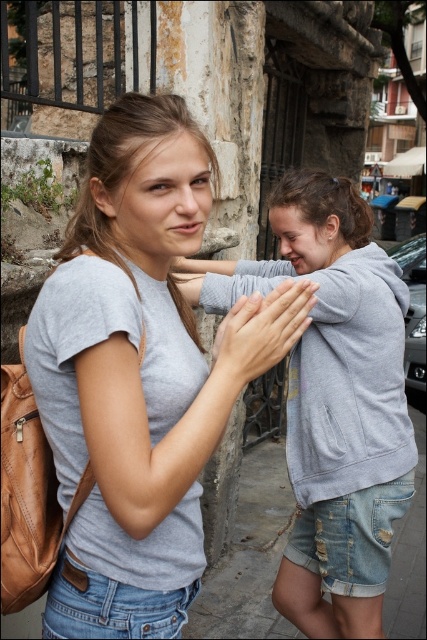
Question: Can you confirm if gray matte t-shirt at center is positioned below matte gray hand at center?

Choices:
 (A) no
 (B) yes

Answer: (B)

Question: Which point appears farthest from the camera in this image?

Choices:
 (A) (157, 445)
 (B) (251, 323)
 (C) (310, 529)

Answer: (C)

Question: Does gray matte t-shirt at center appear on the left side of matte gray hoodie at center?

Choices:
 (A) no
 (B) yes

Answer: (B)

Question: Among these objects, which one is farthest from the camera?

Choices:
 (A) matte gray hand at center
 (B) matte gray hoodie at center

Answer: (B)

Question: Which of these objects is positioned farthest from the matte gray hoodie at center?

Choices:
 (A) gray matte t-shirt at center
 (B) matte gray hand at center

Answer: (B)

Question: Does gray matte t-shirt at center appear under matte gray hand at center?

Choices:
 (A) no
 (B) yes

Answer: (B)